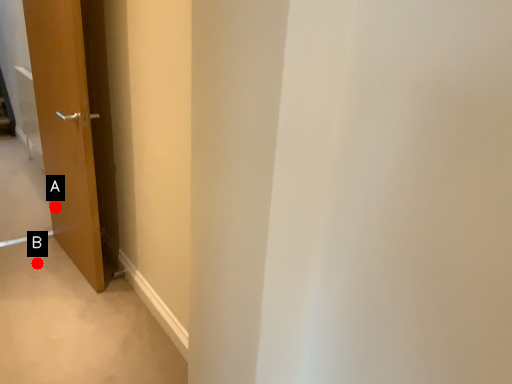
Question: Two points are circled on the image, labeled by A and B beside each circle. Which point is closer to the camera taking this photo?

Choices:
 (A) A is closer
 (B) B is closer

Answer: (B)